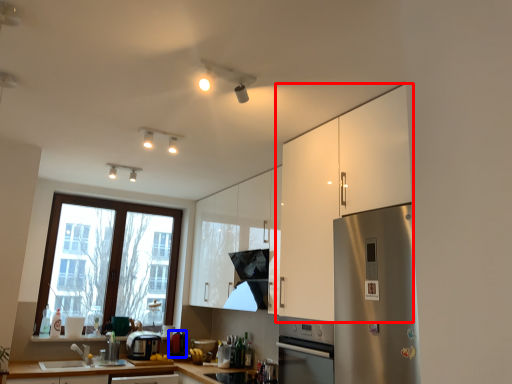
Question: Which object appears closest to the camera in this image, cabinetry (highlighted by a red box) or appliance (highlighted by a blue box)?

Choices:
 (A) cabinetry
 (B) appliance

Answer: (A)